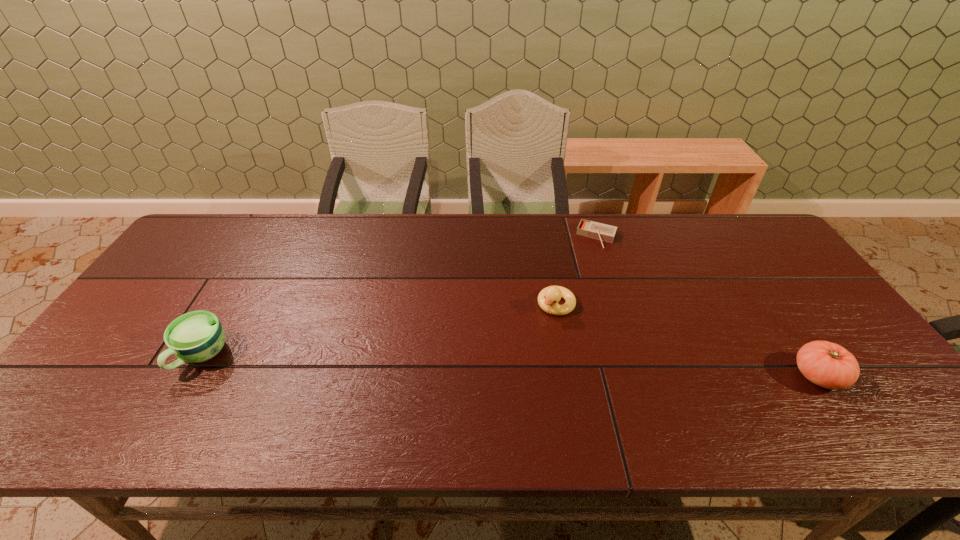
Where is `free space on the desktop that is between the leftmost object and the rightmost object and is positioned on the striking surface of the matchbox`? The height and width of the screenshot is (540, 960). free space on the desktop that is between the leftmost object and the rightmost object and is positioned on the striking surface of the matchbox is located at coordinates (545, 367).

Find the location of a particular element. vacant space on the desktop that is between the cup and the rightmost object and is positioned at the beak of the second object from left to right is located at coordinates (506, 366).